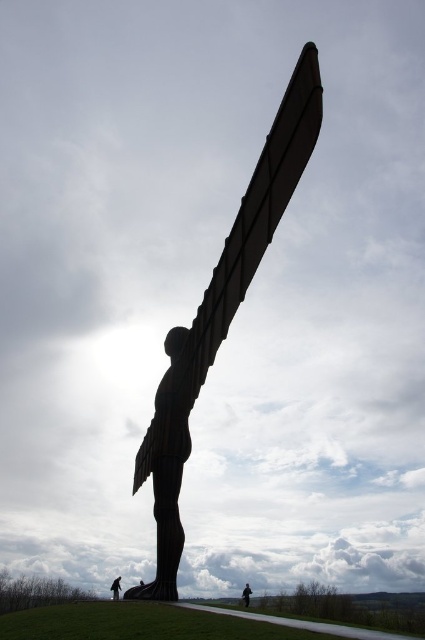
Question: Which point is farther to the camera?

Choices:
 (A) black polished statue at center
 (B) black matte figure at lower center

Answer: (B)

Question: Which object is the closest to the black matte figure at lower center?

Choices:
 (A) black polished statue at center
 (B) dark brown leather jacket at lower center

Answer: (B)

Question: Is black polished statue at center to the left of black matte figure at lower center from the viewer's perspective?

Choices:
 (A) yes
 (B) no

Answer: (B)

Question: Which of the following is the farthest from the observer?

Choices:
 (A) (190, 388)
 (B) (113, 592)
 (C) (246, 592)

Answer: (C)

Question: Where is black matte figure at lower center located in relation to dark brown leather jacket at lower center in the image?

Choices:
 (A) below
 (B) above

Answer: (B)

Question: Does black polished statue at center appear on the right side of dark brown leather jacket at lower center?

Choices:
 (A) no
 (B) yes

Answer: (A)